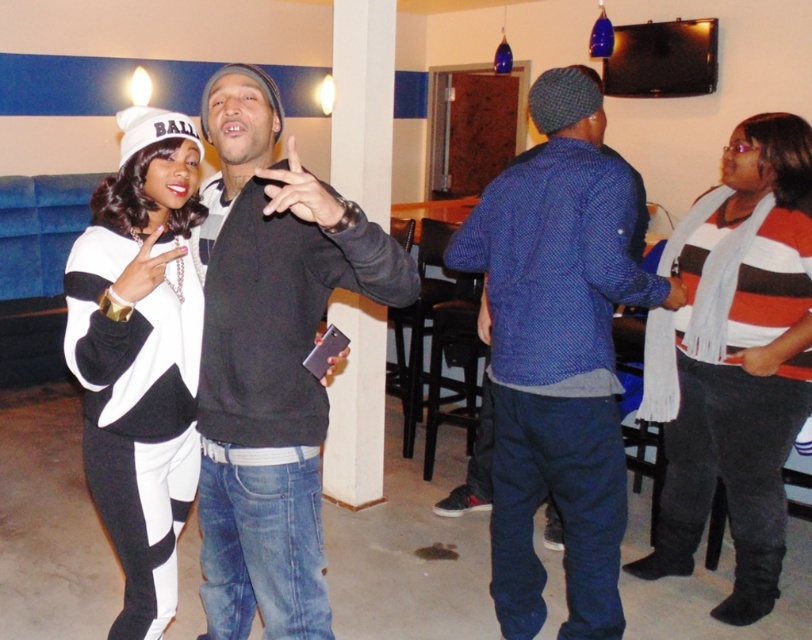
You are trying to decide which item to take with you for a chilly evening walk. Both the blue textured sweater at center and the striped wool scarf at right are available. Based on their sizes, which one might be easier to carry in a small bag?

The blue textured sweater at center has a lesser height compared to the striped wool scarf at right, so it might be easier to carry in a small bag.